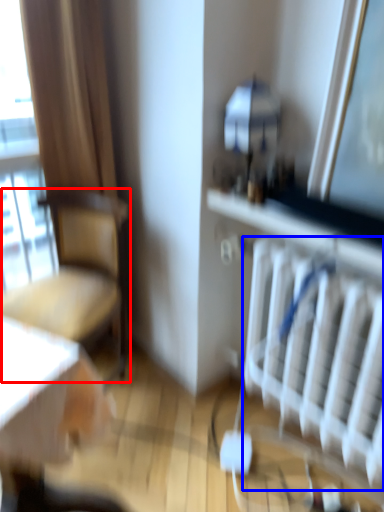
Question: Which object is further to the camera taking this photo, chair (highlighted by a red box) or radiator (highlighted by a blue box)?

Choices:
 (A) chair
 (B) radiator

Answer: (A)